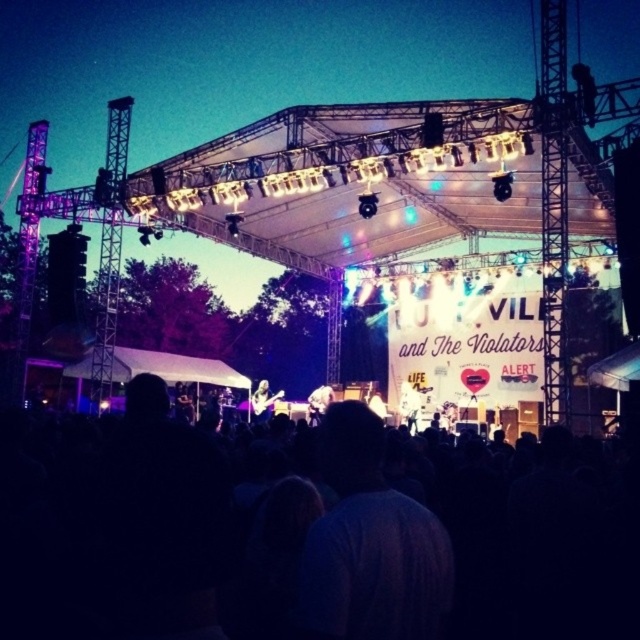
Does black fabric crowd at center have a lesser width compared to glossy black guitar at center?

No.

Locate an element on the screen. The width and height of the screenshot is (640, 640). black fabric crowd at center is located at coordinates (298, 538).

I want to click on black fabric crowd at center, so click(298, 538).

Which of these two, glossy black guitar at center or shiny black guitar at center, stands shorter?

With less height is shiny black guitar at center.

Who is lower down, glossy black guitar at center or shiny black guitar at center?

glossy black guitar at center is below.

The image size is (640, 640). What do you see at coordinates (262, 401) in the screenshot? I see `glossy black guitar at center` at bounding box center [262, 401].

Identify the location of glossy black guitar at center. The height and width of the screenshot is (640, 640). (262, 401).

Which of these two, white fabric at center or glossy black guitar at center, stands shorter?

With less height is white fabric at center.

Can you confirm if white fabric at center is wider than glossy black guitar at center?

In fact, white fabric at center might be narrower than glossy black guitar at center.

Is point (412, 413) farther from viewer compared to point (268, 394)?

That is False.

At what (x,y) coordinates should I click in order to perform the action: click on white fabric at center. Please return your answer as a coordinate pair (x, y). The height and width of the screenshot is (640, 640). Looking at the image, I should click on (410, 404).